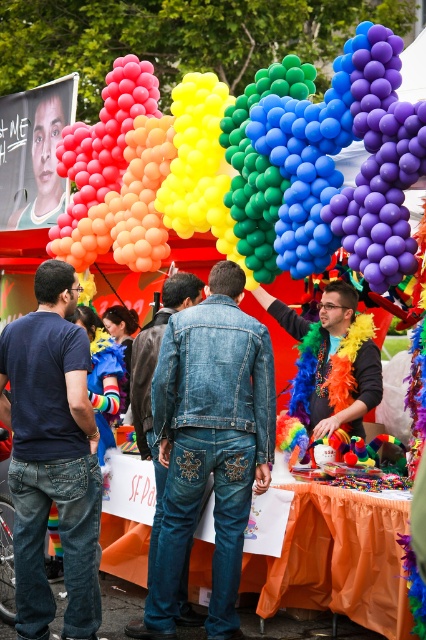
Does rainbow balloons at upper center have a larger size compared to denim jacket at center?

Yes, rainbow balloons at upper center is bigger than denim jacket at center.

Is point (298, 173) behind point (42, 307)?

Yes, point (298, 173) is behind point (42, 307).

What are the coordinates of `rainbow balloons at upper center` in the screenshot? It's located at click(304, 170).

Is denim jacket at center shorter than rainbow feather boa at center?

No, denim jacket at center is not shorter than rainbow feather boa at center.

Is denim jacket at center behind rainbow feather boa at center?

No, it is not.

Identify the location of denim jacket at center. (52, 456).

Between faded denim jacket at center and rainbow feather boa at center, which one has less height?

With less height is rainbow feather boa at center.

What do you see at coordinates (209, 445) in the screenshot? The height and width of the screenshot is (640, 426). I see `faded denim jacket at center` at bounding box center [209, 445].

Image resolution: width=426 pixels, height=640 pixels. Identify the location of faded denim jacket at center. (209, 445).